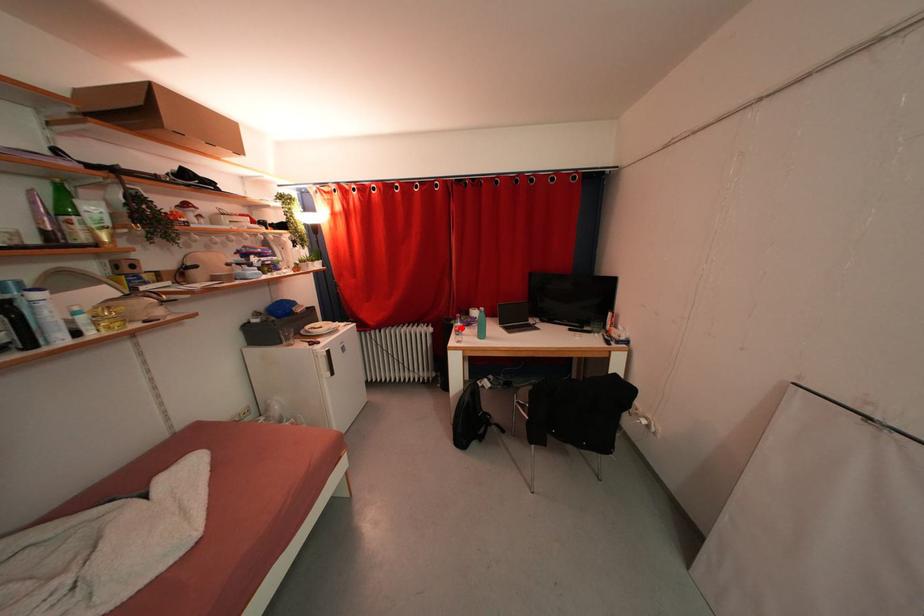
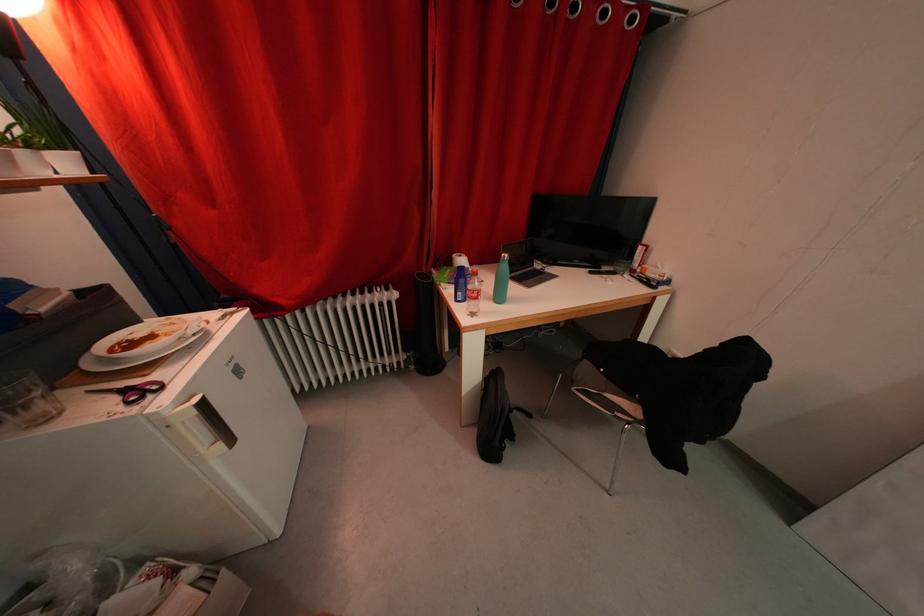
Find the pixel in the second image that matches the highlighted location in the first image.

(476, 291)